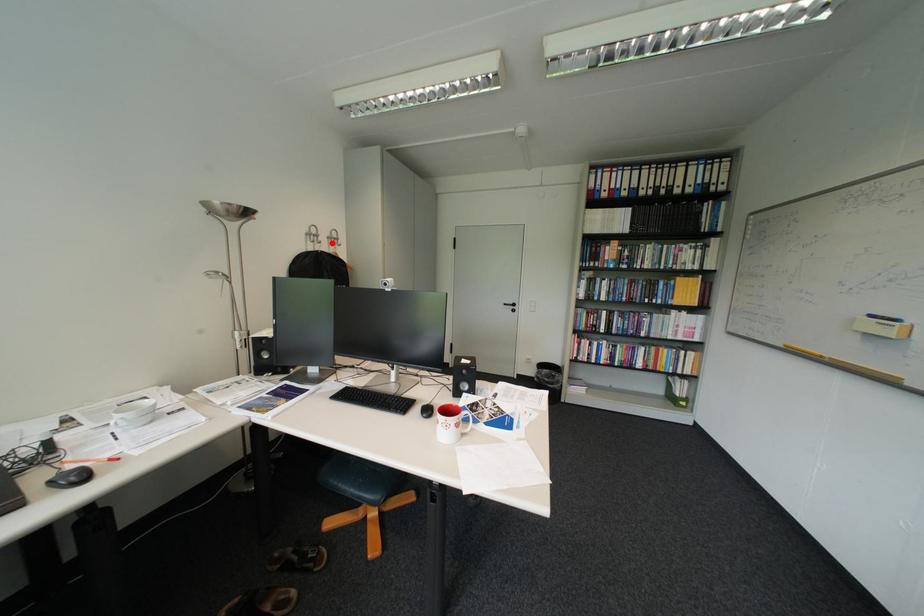
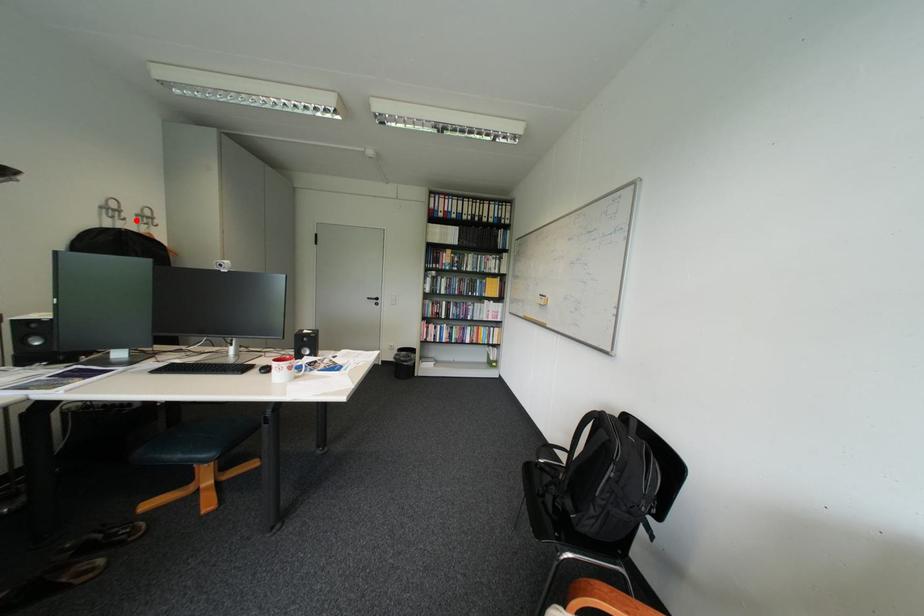
I am providing you with two images of the same scene from different viewpoints. A red point is marked on the first image and another point is marked on the second image. Does the point marked in image1 correspond to the same location as the one in image2?

Yes